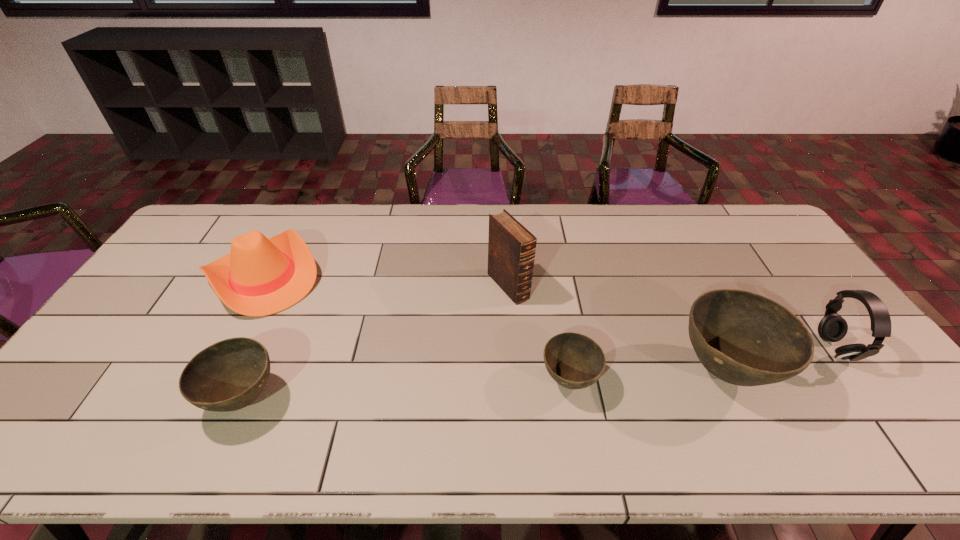
In the image, there is a desktop. Identify the location of vacant space at the far edge. (338, 207).

Where is `free space at the near edge of the desktop`? The image size is (960, 540). free space at the near edge of the desktop is located at coordinates (598, 411).

At what (x,y) coordinates should I click in order to perform the action: click on free region at the left edge of the desktop. Please return your answer as a coordinate pair (x, y). Image resolution: width=960 pixels, height=540 pixels. Looking at the image, I should click on (156, 307).

Where is `vacant space at the right edge of the desktop`? This screenshot has height=540, width=960. vacant space at the right edge of the desktop is located at coordinates tap(816, 367).

In the image, there is a desktop. Identify the location of free space at the far right corner. (726, 223).

Image resolution: width=960 pixels, height=540 pixels. I want to click on empty space between the leftmost bowl and the tallest bowl, so click(484, 385).

At what (x,y) coordinates should I click in order to perform the action: click on vacant area that lies between the cowboy hat and the Bible. Please return your answer as a coordinate pair (x, y). The image size is (960, 540). Looking at the image, I should click on (386, 281).

Locate an element on the screen. free space between the cowboy hat and the tallest bowl is located at coordinates (493, 324).

Where is `empty location between the fourth object from left to right and the tallest bowl`? Image resolution: width=960 pixels, height=540 pixels. empty location between the fourth object from left to right and the tallest bowl is located at coordinates (646, 376).

Where is `blank region between the tallest bowl and the cowboy hat`? blank region between the tallest bowl and the cowboy hat is located at coordinates (493, 324).